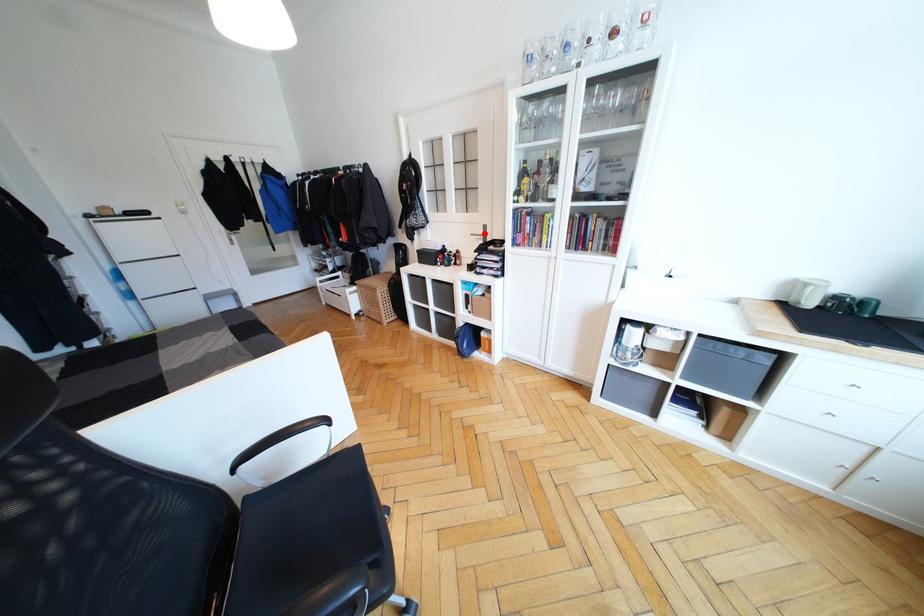
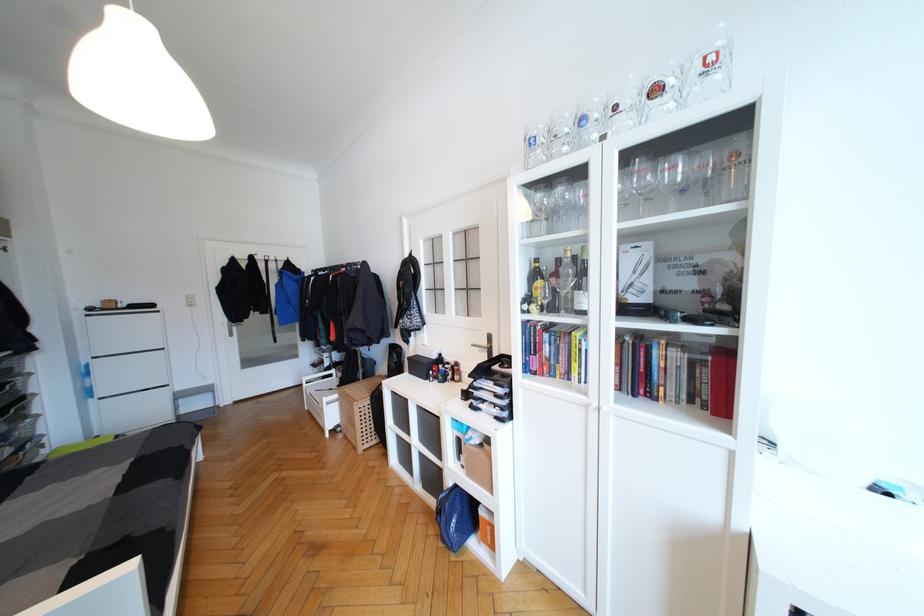
The point at the highlighted location is marked in the first image. Where is the corresponding point in the second image?

(488, 344)